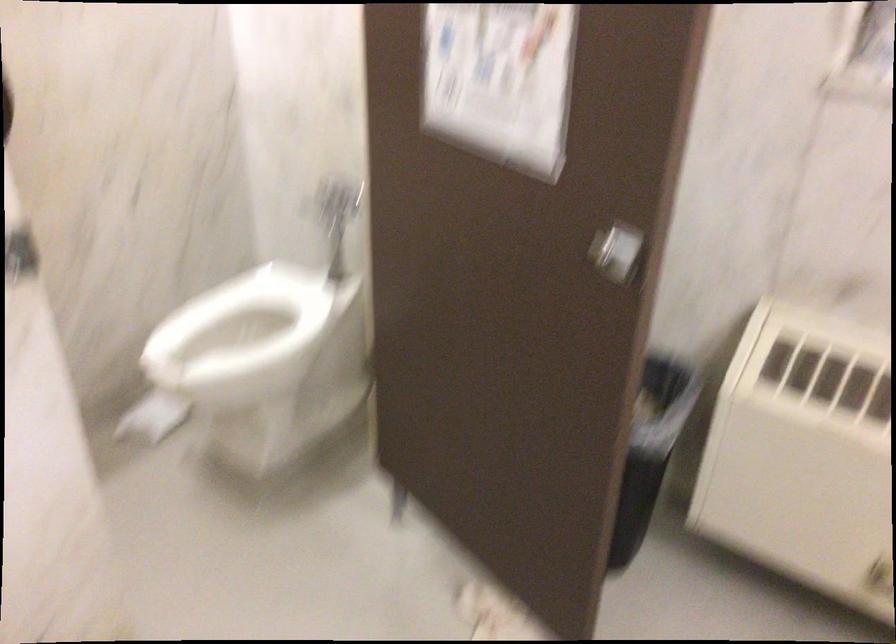
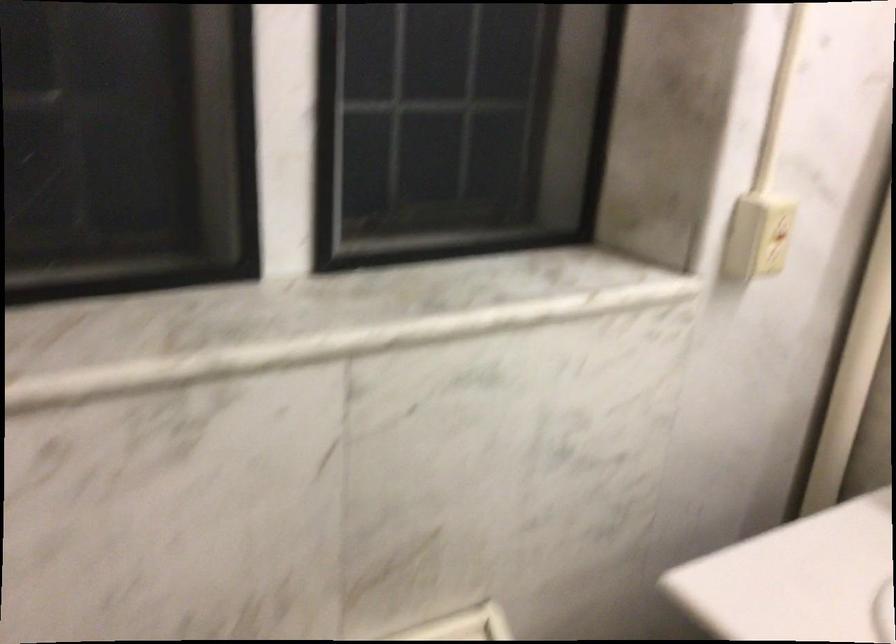
Question: The camera is either moving clockwise (left) or counter-clockwise (right) around the object. The first image is from the beginning of the video and the second image is from the end. Is the camera moving left or right when shooting the video?

Choices:
 (A) Left
 (B) Right

Answer: (A)